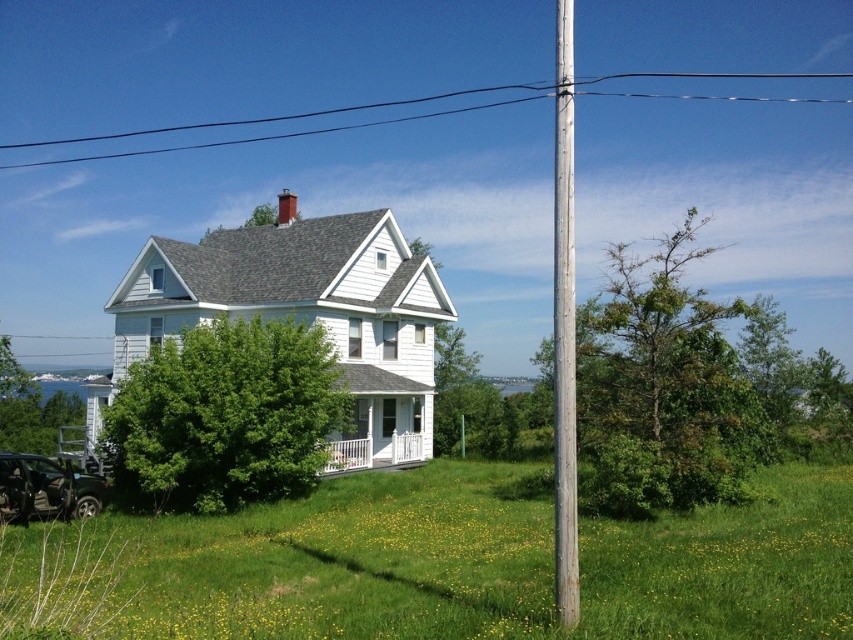
From the picture: Who is more distant from viewer, (360, 108) or (62, 412)?

The point (360, 108) is behind.

Who is more forward, (337, 129) or (6, 420)?

Positioned in front is point (6, 420).

You are a GUI agent. You are given a task and a screenshot of the screen. Output one action in this format:
    pyautogui.click(x=<x>, y=<y>)
    Task: Click on the black wire at upper center
    
    Given the screenshot: What is the action you would take?
    pyautogui.click(x=277, y=122)

Who is higher up, green leafy tree at center or black wire at upper center?

black wire at upper center is higher up.

Does green leafy tree at center lie in front of black wire at upper center?

Yes.

Where is `green leafy tree at center`? This screenshot has height=640, width=853. green leafy tree at center is located at coordinates (225, 417).

Find the location of a particular element. green leafy tree at center is located at coordinates (225, 417).

Does green rough wood pole at right lie in front of metallic black car at lower left?

Yes, it is in front of metallic black car at lower left.

Looking at this image, which of these two, green rough wood pole at right or metallic black car at lower left, stands taller?

green rough wood pole at right is taller.

What do you see at coordinates (663, 387) in the screenshot? The image size is (853, 640). I see `green rough wood pole at right` at bounding box center [663, 387].

Identify the location of green rough wood pole at right. This screenshot has width=853, height=640. click(x=663, y=387).